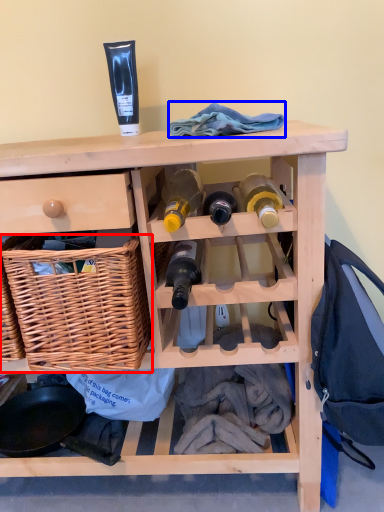
Question: Which object is closer to the camera taking this photo, basket (highlighted by a red box) or clothing (highlighted by a blue box)?

Choices:
 (A) basket
 (B) clothing

Answer: (A)